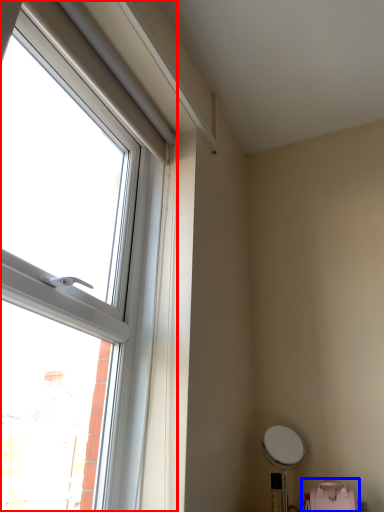
Question: Among these objects, which one is nearest to the camera, window (highlighted by a red box) or swivel chair (highlighted by a blue box)?

Choices:
 (A) window
 (B) swivel chair

Answer: (A)